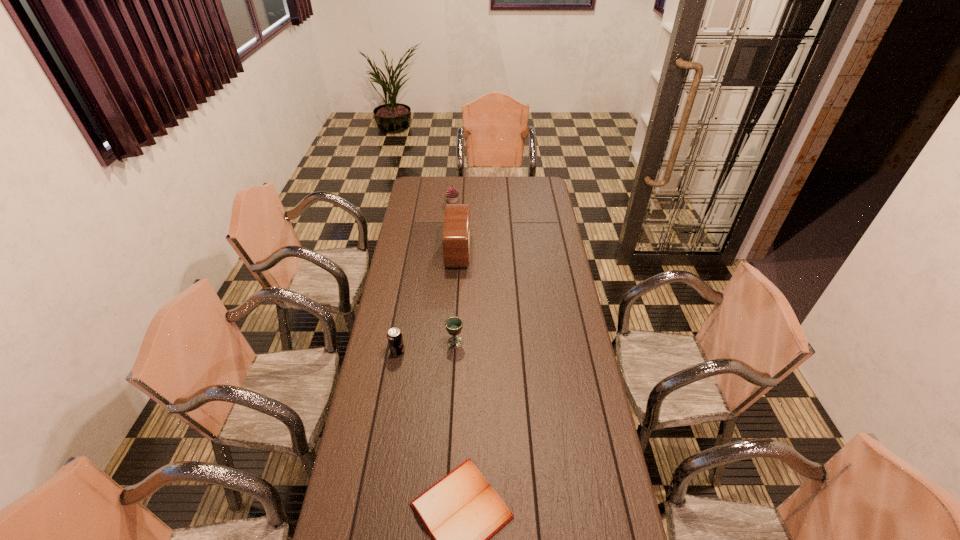
Image resolution: width=960 pixels, height=540 pixels. What are the coordinates of `free space at the left edge` in the screenshot? It's located at (422, 221).

Find the location of a particular element. This screenshot has width=960, height=540. vacant space at the far right corner of the desktop is located at coordinates click(539, 178).

You are a GUI agent. You are given a task and a screenshot of the screen. Output one action in this format:
    pyautogui.click(x=<x>, y=<y>)
    Task: Click on the vacant region between the leftmost object and the chalice
    
    Given the screenshot: What is the action you would take?
    pyautogui.click(x=426, y=347)

Image resolution: width=960 pixels, height=540 pixels. In order to click on free spot between the leftmost object and the farthest object in this screenshot , I will do `click(425, 276)`.

Identify the location of vacant point located between the leftmost object and the cupcake. This screenshot has height=540, width=960. (425, 276).

Identify the location of free space between the farthest object and the leftmost object. This screenshot has height=540, width=960. (425, 276).

I want to click on object that is the second closest to the tallest object, so click(x=454, y=325).

Where is `object identified as the second closest to the cupcake`? The image size is (960, 540). object identified as the second closest to the cupcake is located at coordinates (454, 325).

Find the location of `free spot that satisfies the following two spatial constraints: 1. on the front-facing side of the chalice; 2. on the right side of the second farthest object`. free spot that satisfies the following two spatial constraints: 1. on the front-facing side of the chalice; 2. on the right side of the second farthest object is located at coordinates (452, 342).

This screenshot has width=960, height=540. In order to click on vacant space that satisfies the following two spatial constraints: 1. on the back side of the chalice; 2. on the left side of the soda can in this screenshot , I will do `click(399, 342)`.